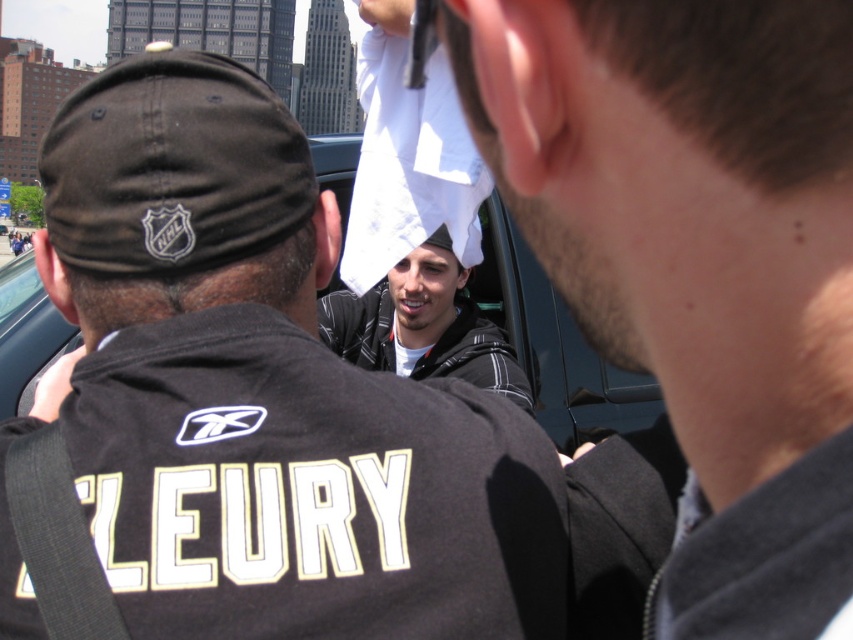
Does white paper towel at center appear over black fabric baseball cap at upper center?

Actually, white paper towel at center is below black fabric baseball cap at upper center.

Is point (456, 499) farther from viewer compared to point (137, 131)?

That is False.

Where is `white paper towel at center`? This screenshot has width=853, height=640. white paper towel at center is located at coordinates (257, 396).

Is point (299, 200) behind point (495, 240)?

No.

Does black fabric baseball cap at upper center lie behind black matte car at center?

No, it is in front of black matte car at center.

Is point (279, 237) farther from viewer compared to point (653, 381)?

That is False.

At what (x,y) coordinates should I click in order to perform the action: click on black fabric baseball cap at upper center. Please return your answer as a coordinate pair (x, y). The image size is (853, 640). Looking at the image, I should click on (172, 168).

Consider the image. Is black fabric baseball cap at upper center positioned in front of white cotton towel at center?

Yes, black fabric baseball cap at upper center is closer to the viewer.

Can you confirm if black fabric baseball cap at upper center is shorter than white cotton towel at center?

In fact, black fabric baseball cap at upper center may be taller than white cotton towel at center.

Is point (251, 209) closer to viewer compared to point (489, 337)?

That is True.

At what (x,y) coordinates should I click in order to perform the action: click on black fabric baseball cap at upper center. Please return your answer as a coordinate pair (x, y). Looking at the image, I should click on (172, 168).